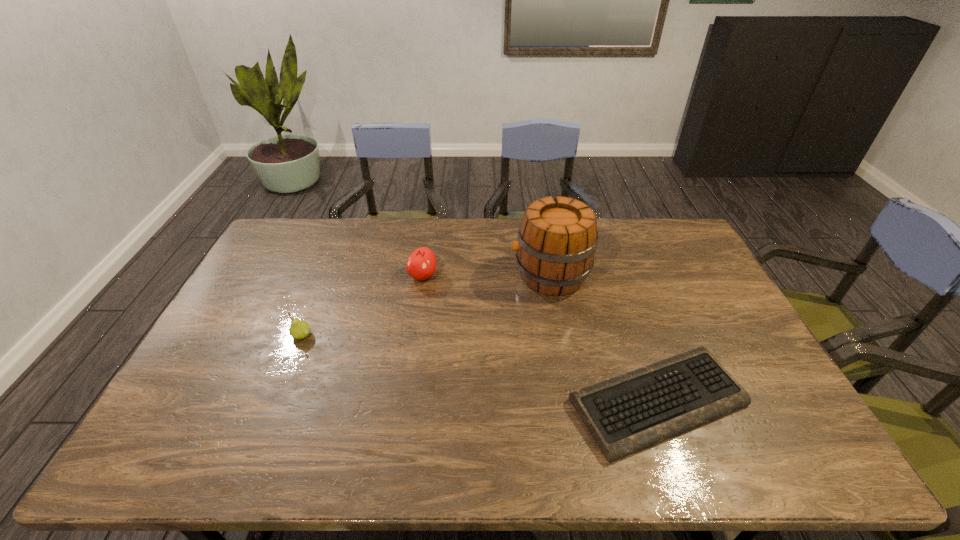
Locate an element on the screen. vacant region that satisfies the following two spatial constraints: 1. on the side of the tallest object where the spigot is located; 2. on the back side of the nearest object is located at coordinates pyautogui.click(x=573, y=402).

This screenshot has height=540, width=960. I want to click on free location that satisfies the following two spatial constraints: 1. on the side of the tallest object where the spigot is located; 2. on the left side of the shortest object, so click(573, 402).

At what (x,y) coordinates should I click in order to perform the action: click on vacant area that satisfies the following two spatial constraints: 1. on the back side of the shortest object; 2. on the side of the cider where the spigot is located. Please return your answer as a coordinate pair (x, y). Looking at the image, I should click on (613, 275).